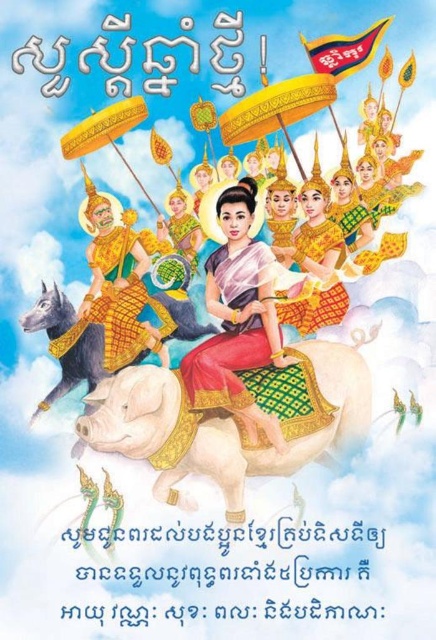
In the image, there is a silk fabric woman at center and a dark gray matte horse at center. Which object takes up more space in the image?

The silk fabric woman at center is bigger than the dark gray matte horse at center, so she takes up more space in the image.

What is the exact coordinate of the white textured horse at center?

The white textured horse at center is located at point (231,420).